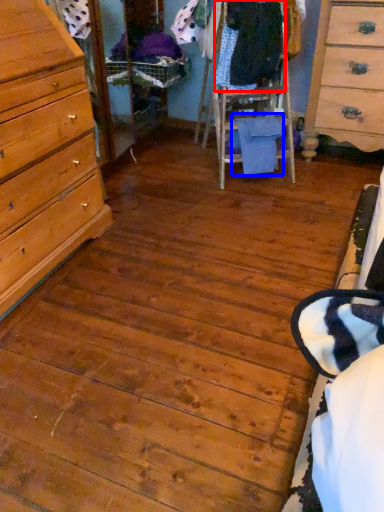
Question: Which object appears farthest to the camera in this image, clothing (highlighted by a red box) or clothing (highlighted by a blue box)?

Choices:
 (A) clothing
 (B) clothing

Answer: (B)